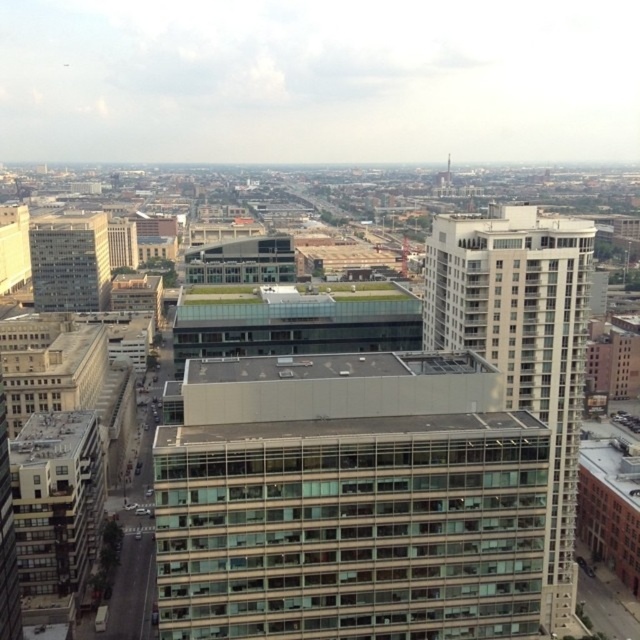
Is white glass building at center to the left of light gray concrete building at left from the viewer's perspective?

Incorrect, white glass building at center is not on the left side of light gray concrete building at left.

Which of these two, white glass building at center or light gray concrete building at left, stands taller?

Standing taller between the two is white glass building at center.

Does point (424, 307) come farther from viewer compared to point (33, 250)?

No, (424, 307) is in front of (33, 250).

The width and height of the screenshot is (640, 640). Find the location of `white glass building at center`. white glass building at center is located at coordinates (522, 342).